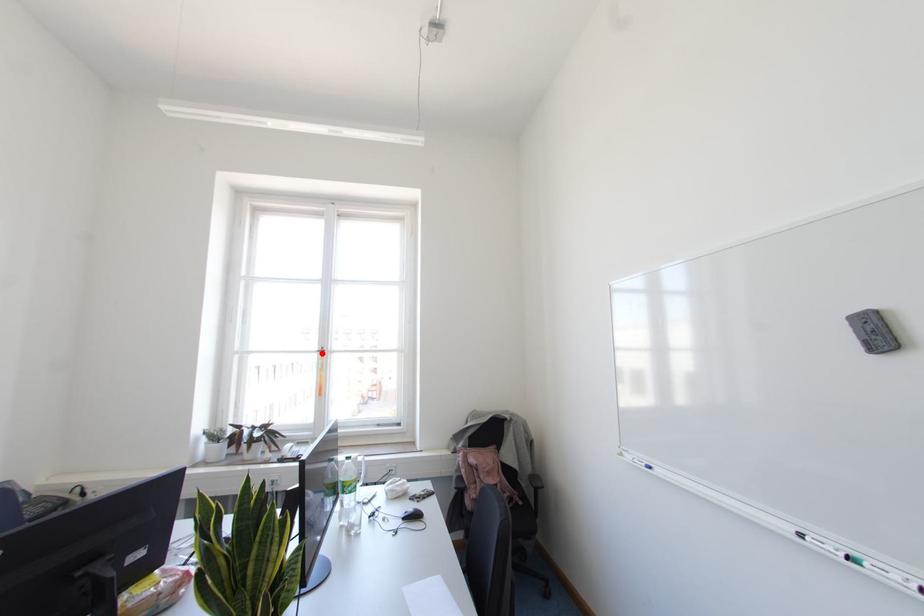
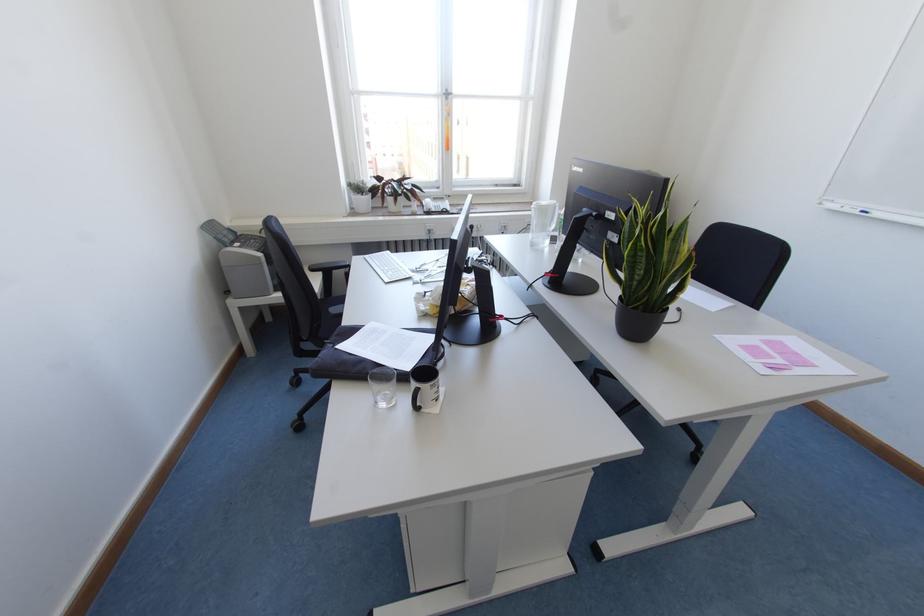
Where in the second image is the point corresponding to the highlighted location from the first image?

(446, 98)